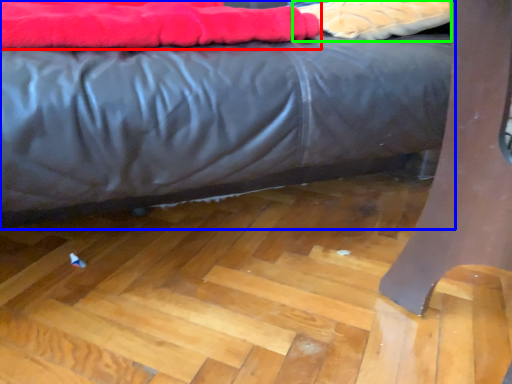
Question: Estimate the real-world distances between objects in this image. Which object is farther from blanket (highlighted by a red box), bed (highlighted by a blue box) or material (highlighted by a green box)?

Choices:
 (A) bed
 (B) material

Answer: (B)